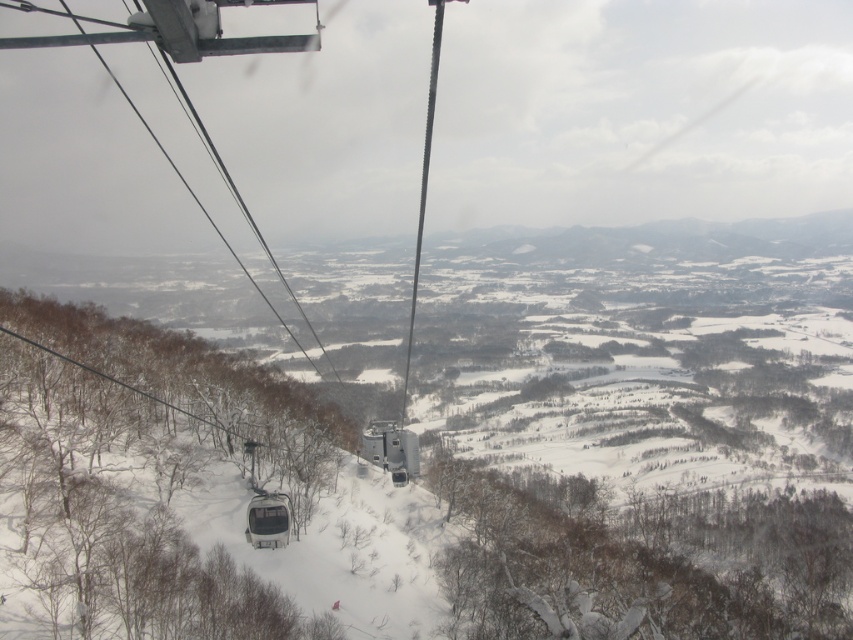
Question: Is metallic gray ski lift at center wider than metallic cable car at center?

Choices:
 (A) no
 (B) yes

Answer: (B)

Question: Which of the following is the farthest from the observer?

Choices:
 (A) (276, 500)
 (B) (434, 289)
 (C) (167, 154)

Answer: (C)

Question: Can you confirm if white snow ski slope at center is wider than metallic cable car at center?

Choices:
 (A) yes
 (B) no

Answer: (A)

Question: Which point is farther to the camera?

Choices:
 (A) (200, 403)
 (B) (273, 528)
 (C) (381, 428)

Answer: (A)

Question: Which point is closer to the camera?

Choices:
 (A) metallic cable car at center
 (B) white snow ski slope at center
 (C) metallic gray ski lift at center

Answer: (B)

Question: Can you confirm if white snow ski slope at center is positioned above metallic gray ski lift at center?

Choices:
 (A) no
 (B) yes

Answer: (B)